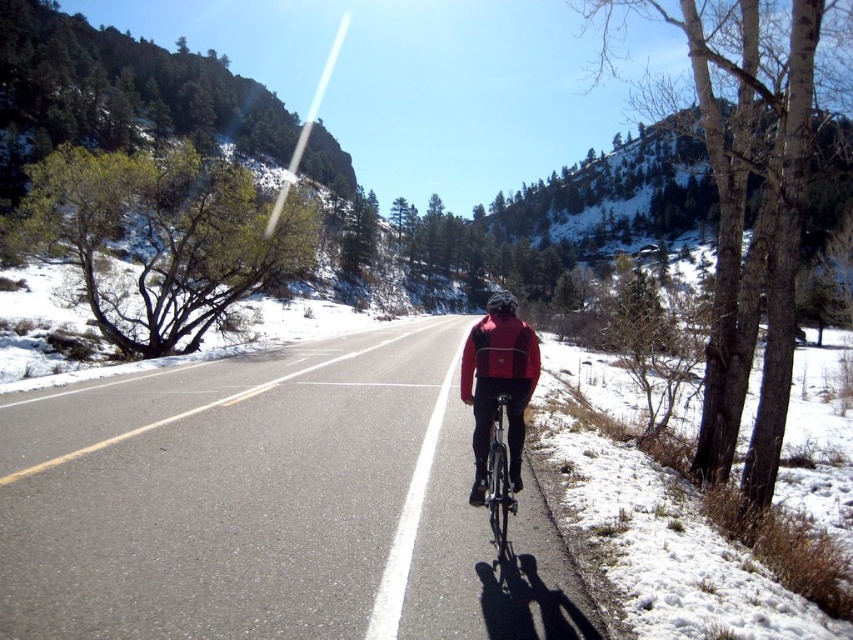
Question: Considering the relative positions of red matte jacket at center and matte black helmet at center in the image provided, where is red matte jacket at center located with respect to matte black helmet at center?

Choices:
 (A) above
 (B) below

Answer: (B)

Question: Which of the following is the closest to the observer?

Choices:
 (A) (143, 536)
 (B) (491, 300)
 (C) (520, 355)
 (D) (492, 401)

Answer: (A)

Question: Among these objects, which one is farthest from the camera?

Choices:
 (A) shiny metallic bicycle at center
 (B) black asphalt road at center
 (C) matte black helmet at center

Answer: (C)

Question: Is black asphalt road at center smaller than matte black helmet at center?

Choices:
 (A) yes
 (B) no

Answer: (A)

Question: Estimate the real-world distances between objects in this image. Which object is farther from the shiny metallic bicycle at center?

Choices:
 (A) black asphalt road at center
 (B) red matte jacket at center

Answer: (A)

Question: Does red matte jacket at center lie behind shiny metallic bicycle at center?

Choices:
 (A) no
 (B) yes

Answer: (B)